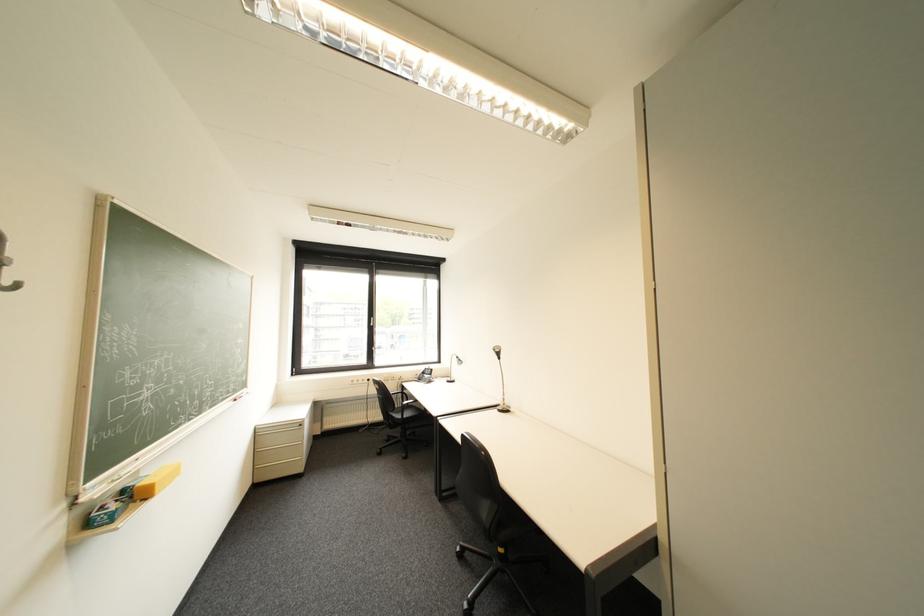
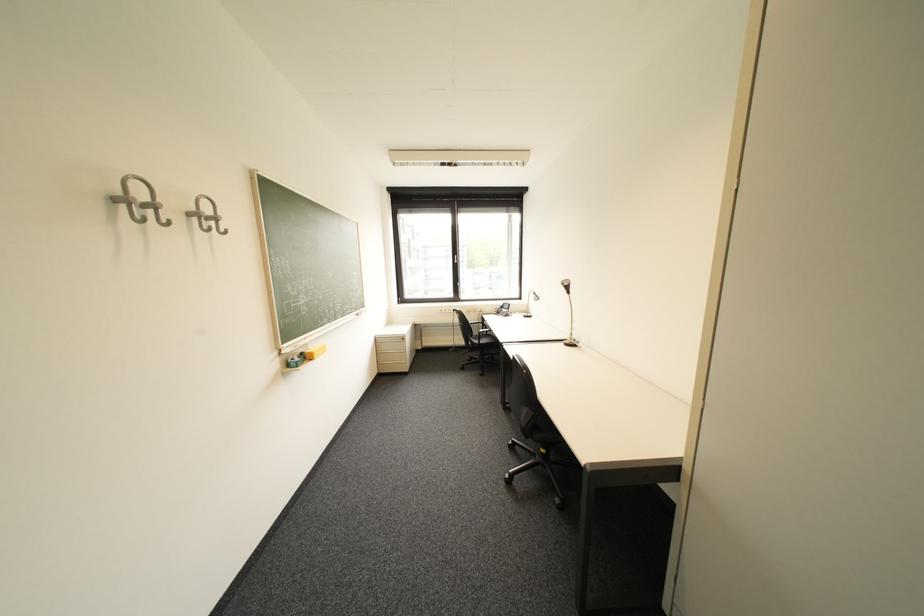
Locate, in the second image, the point that corresponds to (270,435) in the first image.

(388, 342)